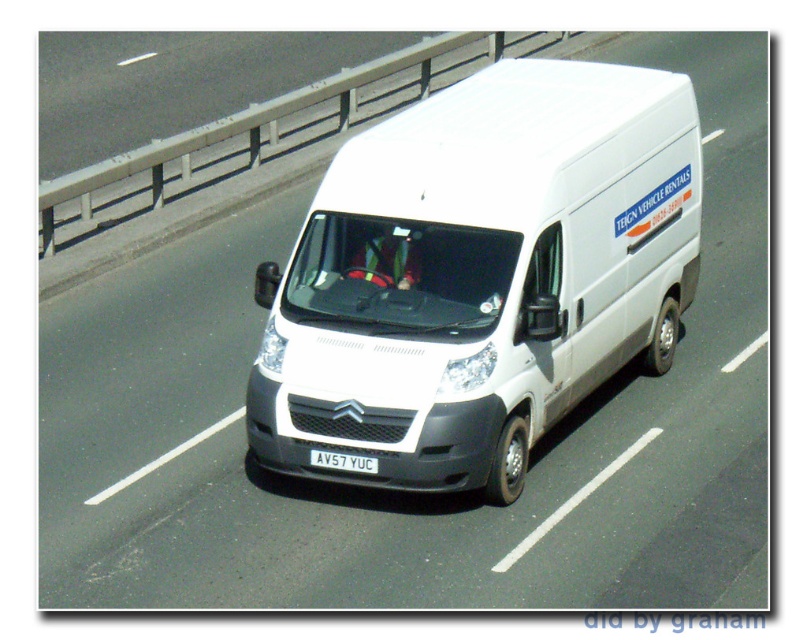
Who is more forward, (668,202) or (312,458)?

Positioned in front is point (312,458).

Does white matte van at center have a smaller size compared to white plastic license plate at center?

No.

This screenshot has width=807, height=640. Describe the element at coordinates (479, 275) in the screenshot. I see `white matte van at center` at that location.

Find the location of `white matte van at center`. white matte van at center is located at coordinates (479, 275).